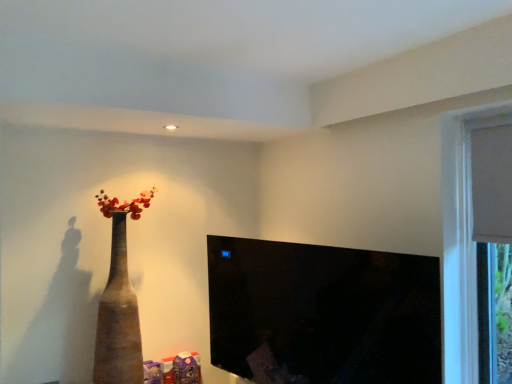
Question: In terms of height, does black glossy tv at center look taller or shorter compared to brown matte vase at left?

Choices:
 (A) tall
 (B) short

Answer: (B)

Question: In the image, is black glossy tv at center on the left side or the right side of brown matte vase at left?

Choices:
 (A) right
 (B) left

Answer: (A)

Question: From the image's perspective, is black glossy tv at center above or below brown matte vase at left?

Choices:
 (A) below
 (B) above

Answer: (A)

Question: Is brown matte vase at left taller or shorter than black glossy tv at center?

Choices:
 (A) tall
 (B) short

Answer: (A)

Question: Does point (128, 331) appear closer or farther from the camera than point (218, 306)?

Choices:
 (A) closer
 (B) farther

Answer: (A)

Question: From the image's perspective, is brown matte vase at left located above or below black glossy tv at center?

Choices:
 (A) below
 (B) above

Answer: (B)

Question: From a real-world perspective, is brown matte vase at left physically located above or below black glossy tv at center?

Choices:
 (A) below
 (B) above

Answer: (B)